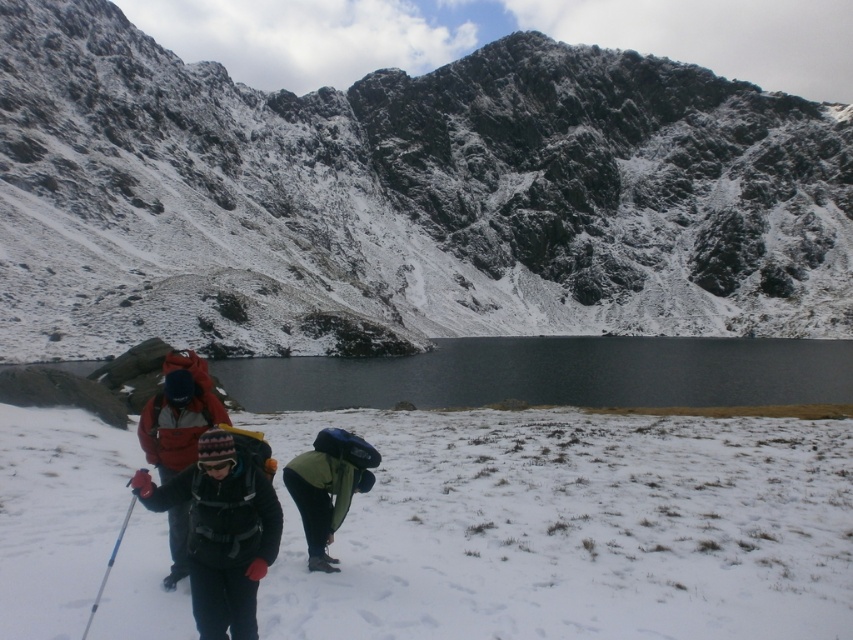
You are a hiker trying to decide which backpack to choose between the matte black backpack at center and the green fabric backpack at lower center. Based on their sizes, which one can carry more items?

The matte black backpack at center might be wider than the green fabric backpack at lower center, so it can carry more items.

From the picture: You are a hiker who wants to know if the matte black backpack at center can fit the blue plastic ski pole at lower left. Can you determine if the backpack is taller than the ski pole?

The matte black backpack at center is taller than blue plastic ski pole at lower left, so yes, the backpack is taller than the ski pole.